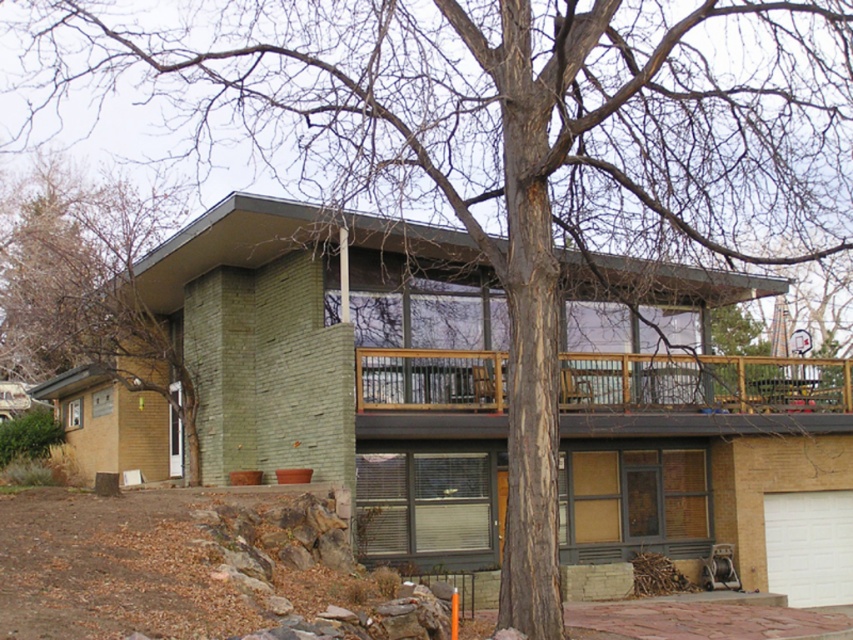
You are a painter who needs to know which object requires a ladder to reach its top. Based on the scene, which one is taller between the green textured wall at left and the wooden deck at upper center?

The green textured wall at left is taller than the wooden deck at upper center, so you would need a ladder to reach its top.

In the scene shown: You are standing in front of the house and want to determine the relative positions of two points marked on the deck. Which point is closer to you, point (41, 154) or point (746, 392)?

Point (41, 154) is closer to you because it is further to the viewer than point (746, 392).